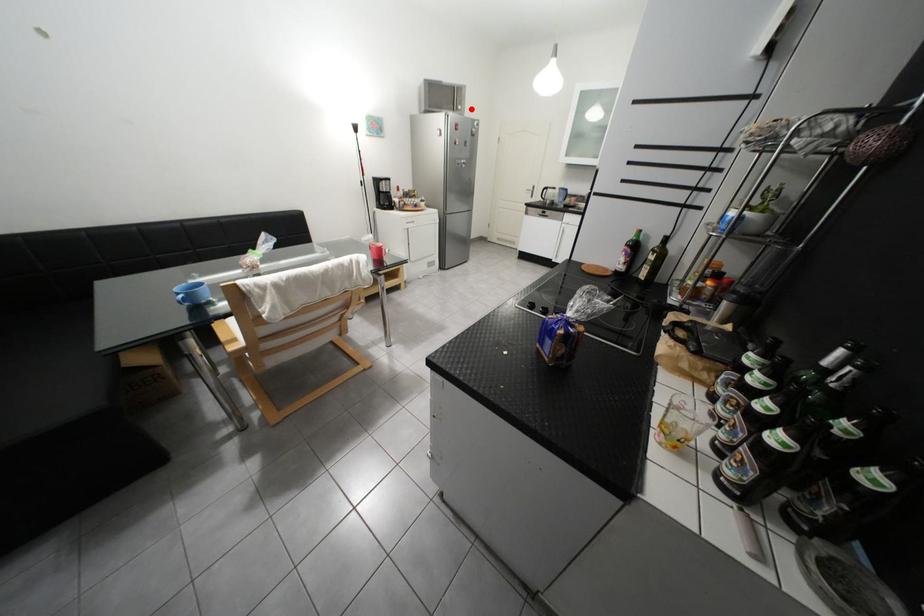
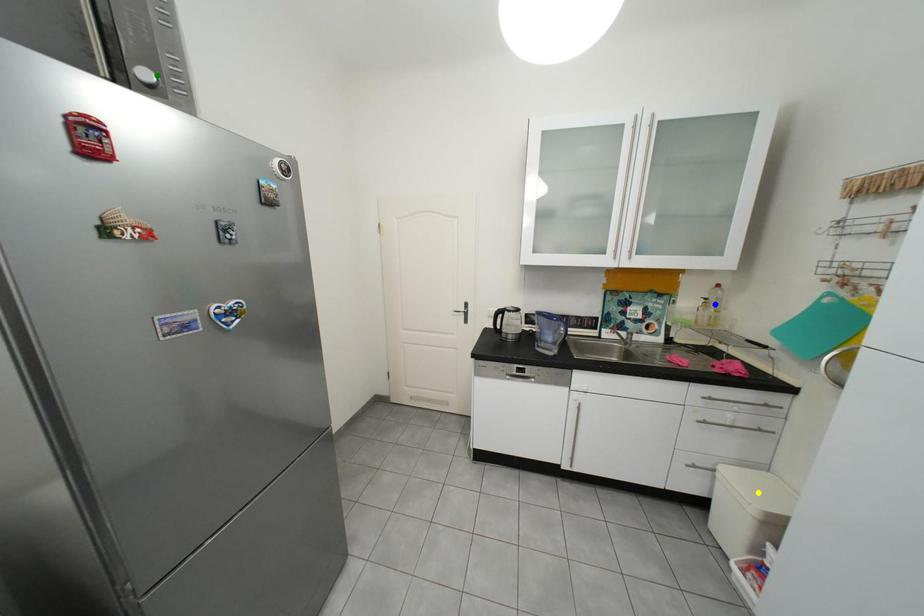
Question: I am providing you with two images of the same scene from different viewpoints. A red point is marked on the first image. You are given multiple points on the second image. In image 2, which mark is for the same physical point as the one in image 1?

Choices:
 (A) blue point
 (B) yellow point
 (C) green point

Answer: (C)